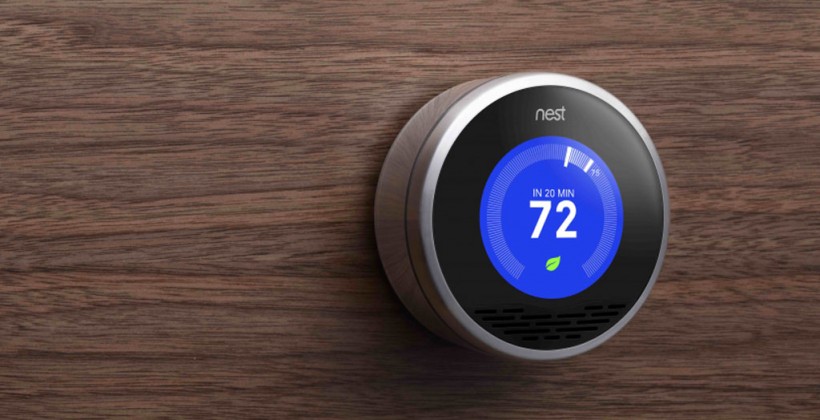
The height and width of the screenshot is (420, 820). Find the location of `thermostat`. thermostat is located at coordinates (611, 205).